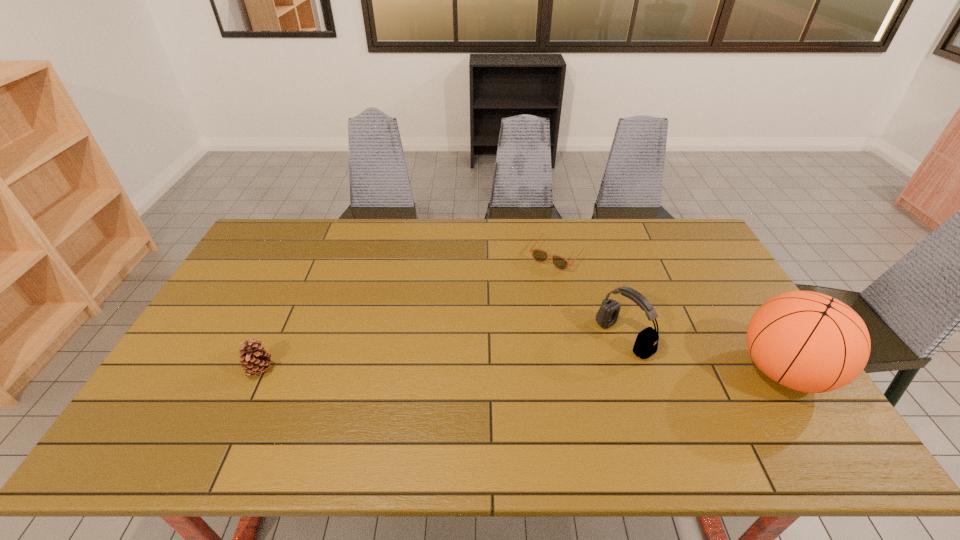
This screenshot has height=540, width=960. I want to click on vacant area that lies between the headset and the pinecone, so click(x=442, y=354).

At what (x,y) coordinates should I click in order to perform the action: click on free point between the third shortest object and the basketball. Please return your answer as a coordinate pair (x, y). Looking at the image, I should click on (704, 354).

Identify the location of free space between the basketball and the shortest object. Image resolution: width=960 pixels, height=540 pixels. (671, 313).

At what (x,y) coordinates should I click in order to perform the action: click on object that is the closest to the headset. Please return your answer as a coordinate pair (x, y). Looking at the image, I should click on (539, 255).

Identify which object is the second closest to the headset. Please provide its 2D coordinates. Your answer should be formatted as a tuple, i.e. [(x, y)], where the tuple contains the x and y coordinates of a point satisfying the conditions above.

[(807, 341)]

At what (x,y) coordinates should I click in order to perform the action: click on free spot that satisfies the following two spatial constraints: 1. on the front side of the third shortest object; 2. on the left side of the basketball. Please return your answer as a coordinate pair (x, y). This screenshot has height=540, width=960. Looking at the image, I should click on (635, 371).

Image resolution: width=960 pixels, height=540 pixels. Identify the location of free space that satisfies the following two spatial constraints: 1. on the front side of the rightmost object; 2. on the right side of the shortest object. (583, 371).